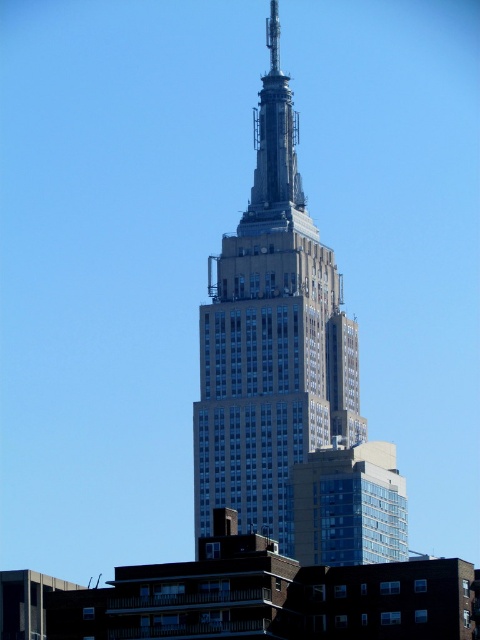
Question: In this image, where is white stone building at center located relative to metallic silver spire at upper center?

Choices:
 (A) above
 (B) below

Answer: (B)

Question: In this image, where is white stone building at center located relative to metallic silver spire at upper center?

Choices:
 (A) left
 (B) right

Answer: (B)

Question: Which object appears farthest from the camera in this image?

Choices:
 (A) metallic silver spire at upper center
 (B) white stone building at center

Answer: (A)

Question: Which of the following is the closest to the observer?

Choices:
 (A) (269, 8)
 (B) (291, 336)

Answer: (B)

Question: From the image, what is the correct spatial relationship of white stone building at center in relation to metallic silver spire at upper center?

Choices:
 (A) below
 (B) above

Answer: (A)